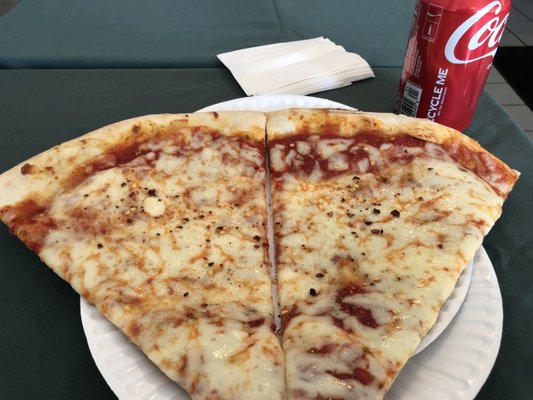
Where is `cushion`? cushion is located at coordinates (49, 355), (129, 45).